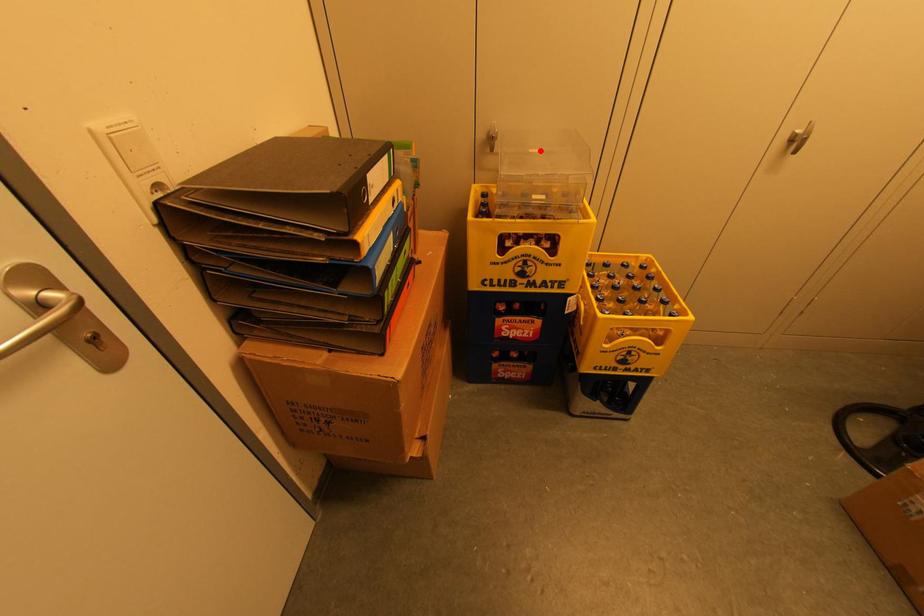
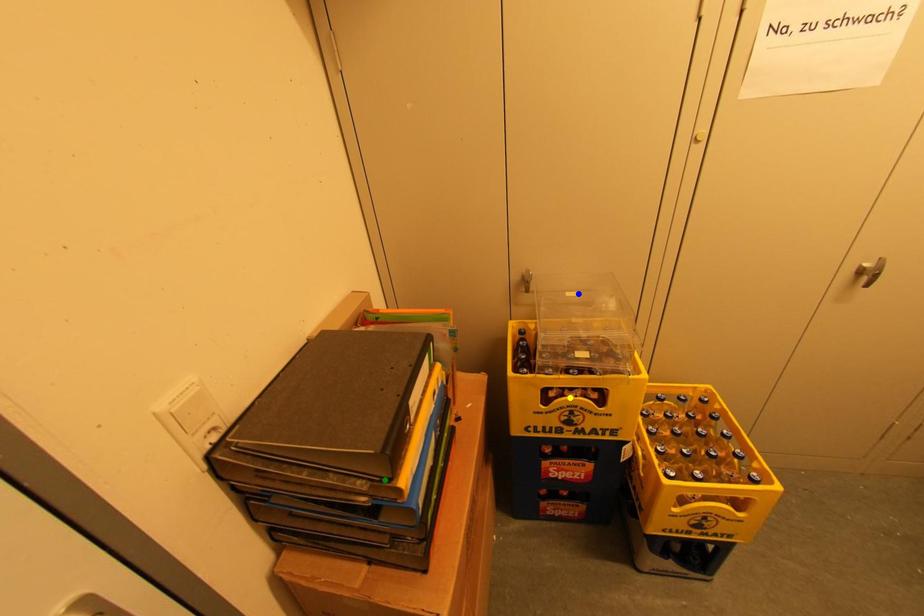
Question: I am providing you with two images of the same scene from different viewpoints. A red point is marked on the first image. You are given multiple points on the second image. Which point in image 2 represents the same 3d spot as the red point in image 1?

Choices:
 (A) blue point
 (B) yellow point
 (C) green point

Answer: (A)